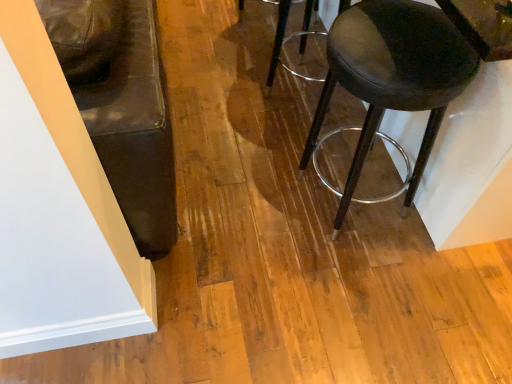
What do you see at coordinates (291, 38) in the screenshot?
I see `transparent plastic stool at center, which ranks as the 2th stool in bottom-to-top order` at bounding box center [291, 38].

At what (x,y) coordinates should I click in order to perform the action: click on transparent plastic stool at center, which ranks as the 2th stool in bottom-to-top order. Please return your answer as a coordinate pair (x, y). Image resolution: width=512 pixels, height=384 pixels. Looking at the image, I should click on (291, 38).

Locate an element on the screen. matte black stool at right, which ranks as the 2th stool in top-to-bottom order is located at coordinates (392, 76).

The height and width of the screenshot is (384, 512). What do you see at coordinates (392, 76) in the screenshot? I see `matte black stool at right, which ranks as the 2th stool in top-to-bottom order` at bounding box center [392, 76].

Locate an element on the screen. Image resolution: width=512 pixels, height=384 pixels. transparent plastic stool at center, which is the 1th stool in top-to-bottom order is located at coordinates (291, 38).

Is transparent plastic stool at center, which ranks as the 2th stool in bottom-to-top order, to the left or to the right of matte black stool at right, which ranks as the 2th stool in top-to-bottom order, in the image?

In the image, transparent plastic stool at center, which ranks as the 2th stool in bottom-to-top order, appears on the left side of matte black stool at right, which ranks as the 2th stool in top-to-bottom order.

Which is behind, transparent plastic stool at center, which ranks as the 2th stool in bottom-to-top order, or matte black stool at right, the 1th stool positioned from the bottom?

Positioned behind is transparent plastic stool at center, which ranks as the 2th stool in bottom-to-top order.

Considering the positions of point (309, 8) and point (366, 125), is point (309, 8) closer or farther from the camera than point (366, 125)?

Point (309, 8) is positioned farther from the camera compared to point (366, 125).

From the image's perspective, is transparent plastic stool at center, which ranks as the 2th stool in bottom-to-top order, beneath matte black stool at right, which ranks as the 2th stool in top-to-bottom order?

Actually, transparent plastic stool at center, which ranks as the 2th stool in bottom-to-top order, appears above matte black stool at right, which ranks as the 2th stool in top-to-bottom order, in the image.

From a real-world perspective, between transparent plastic stool at center, which ranks as the 2th stool in bottom-to-top order, and matte black stool at right, which ranks as the 2th stool in top-to-bottom order, who is vertically lower?

From a 3D spatial view, transparent plastic stool at center, which ranks as the 2th stool in bottom-to-top order, is below.

Does transparent plastic stool at center, which ranks as the 2th stool in bottom-to-top order, have a lesser width compared to matte black stool at right, the 1th stool positioned from the bottom?

Indeed, transparent plastic stool at center, which ranks as the 2th stool in bottom-to-top order, has a lesser width compared to matte black stool at right, the 1th stool positioned from the bottom.

Can you confirm if transparent plastic stool at center, which ranks as the 2th stool in bottom-to-top order, is shorter than matte black stool at right, the 1th stool positioned from the bottom?

Indeed, transparent plastic stool at center, which ranks as the 2th stool in bottom-to-top order, has a lesser height compared to matte black stool at right, the 1th stool positioned from the bottom.

Is transparent plastic stool at center, which is the 1th stool in top-to-bottom order, smaller than matte black stool at right, which ranks as the 2th stool in top-to-bottom order?

Correct, transparent plastic stool at center, which is the 1th stool in top-to-bottom order, occupies less space than matte black stool at right, which ranks as the 2th stool in top-to-bottom order.

Is matte black stool at right, the 1th stool positioned from the bottom, inside transparent plastic stool at center, which ranks as the 2th stool in bottom-to-top order?

No, matte black stool at right, the 1th stool positioned from the bottom, is located outside of transparent plastic stool at center, which ranks as the 2th stool in bottom-to-top order.

Is transparent plastic stool at center, which is the 1th stool in top-to-bottom order, far from matte black stool at right, the 1th stool positioned from the bottom?

No.

Based on the photo, is transparent plastic stool at center, which is the 1th stool in top-to-bottom order, oriented towards matte black stool at right, which ranks as the 2th stool in top-to-bottom order?

No, transparent plastic stool at center, which is the 1th stool in top-to-bottom order, does not turn towards matte black stool at right, which ranks as the 2th stool in top-to-bottom order.

How many degrees apart are the facing directions of transparent plastic stool at center, which ranks as the 2th stool in bottom-to-top order, and matte black stool at right, the 1th stool positioned from the bottom?

The facing directions of transparent plastic stool at center, which ranks as the 2th stool in bottom-to-top order, and matte black stool at right, the 1th stool positioned from the bottom, are 3.03e-05 degrees apart.

How much distance is there between transparent plastic stool at center, which is the 1th stool in top-to-bottom order, and matte black stool at right, the 1th stool positioned from the bottom?

transparent plastic stool at center, which is the 1th stool in top-to-bottom order, and matte black stool at right, the 1th stool positioned from the bottom, are 29.15 inches apart.

You are a GUI agent. You are given a task and a screenshot of the screen. Output one action in this format:
    pyautogui.click(x=<x>, y=<y>)
    Task: Click on the stool above the transparent plastic stool at center, which is the 1th stool in top-to-bottom order (from a real-world perspective)
    The image size is (512, 384).
    Given the screenshot: What is the action you would take?
    pyautogui.click(x=392, y=76)

Which is more to the right, matte black stool at right, the 1th stool positioned from the bottom, or transparent plastic stool at center, which ranks as the 2th stool in bottom-to-top order?

Positioned to the right is matte black stool at right, the 1th stool positioned from the bottom.

In the scene shown: Is matte black stool at right, which ranks as the 2th stool in top-to-bottom order, in front of or behind transparent plastic stool at center, which is the 1th stool in top-to-bottom order, in the image?

In the image, matte black stool at right, which ranks as the 2th stool in top-to-bottom order, appears in front of transparent plastic stool at center, which is the 1th stool in top-to-bottom order.

Between point (436, 34) and point (275, 64), which one is positioned in front?

The point (436, 34) is in front.

From the image's perspective, is matte black stool at right, the 1th stool positioned from the bottom, below transparent plastic stool at center, which is the 1th stool in top-to-bottom order?

Yes, from the image's perspective, matte black stool at right, the 1th stool positioned from the bottom, is below transparent plastic stool at center, which is the 1th stool in top-to-bottom order.

From a real-world perspective, is matte black stool at right, which ranks as the 2th stool in top-to-bottom order, above or below transparent plastic stool at center, which ranks as the 2th stool in bottom-to-top order?

matte black stool at right, which ranks as the 2th stool in top-to-bottom order, is above transparent plastic stool at center, which ranks as the 2th stool in bottom-to-top order.

Between matte black stool at right, the 1th stool positioned from the bottom, and transparent plastic stool at center, which is the 1th stool in top-to-bottom order, which one has larger width?

matte black stool at right, the 1th stool positioned from the bottom.

Considering the sizes of objects matte black stool at right, the 1th stool positioned from the bottom, and transparent plastic stool at center, which ranks as the 2th stool in bottom-to-top order, in the image provided, who is taller, matte black stool at right, the 1th stool positioned from the bottom, or transparent plastic stool at center, which ranks as the 2th stool in bottom-to-top order,?

matte black stool at right, the 1th stool positioned from the bottom, is taller.

Is matte black stool at right, which ranks as the 2th stool in top-to-bottom order, bigger or smaller than transparent plastic stool at center, which is the 1th stool in top-to-bottom order?

matte black stool at right, which ranks as the 2th stool in top-to-bottom order, is bigger than transparent plastic stool at center, which is the 1th stool in top-to-bottom order.

Is matte black stool at right, the 1th stool positioned from the bottom, spatially inside transparent plastic stool at center, which is the 1th stool in top-to-bottom order, or outside of it?

matte black stool at right, the 1th stool positioned from the bottom, is outside transparent plastic stool at center, which is the 1th stool in top-to-bottom order.

Is matte black stool at right, which ranks as the 2th stool in top-to-bottom order, in contact with transparent plastic stool at center, which ranks as the 2th stool in bottom-to-top order?

No, matte black stool at right, which ranks as the 2th stool in top-to-bottom order, is not in contact with transparent plastic stool at center, which ranks as the 2th stool in bottom-to-top order.

Could you tell me if matte black stool at right, which ranks as the 2th stool in top-to-bottom order, is facing transparent plastic stool at center, which is the 1th stool in top-to-bottom order?

No.

Can you tell me how much matte black stool at right, which ranks as the 2th stool in top-to-bottom order, and transparent plastic stool at center, which is the 1th stool in top-to-bottom order, differ in facing direction?

3.03e-05 degrees.

How much distance is there between matte black stool at right, the 1th stool positioned from the bottom, and transparent plastic stool at center, which ranks as the 2th stool in bottom-to-top order?

29.15 inches.

What are the coordinates of `stool that is under the matte black stool at right, the 1th stool positioned from the bottom (from a real-world perspective)` in the screenshot? It's located at (291, 38).

In order to click on stool behind the matte black stool at right, the 1th stool positioned from the bottom in this screenshot , I will do `click(291, 38)`.

I want to click on stool on the left of matte black stool at right, the 1th stool positioned from the bottom, so click(291, 38).